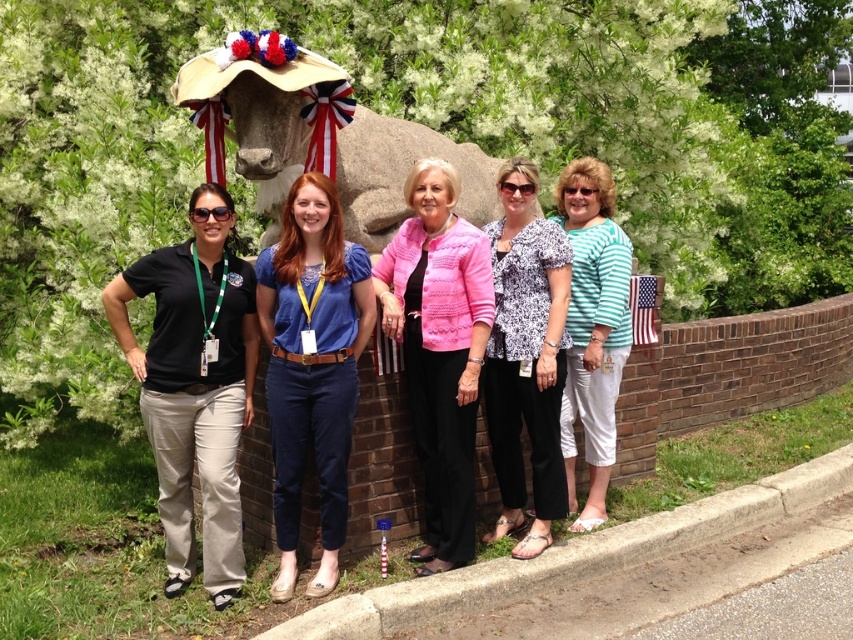
In the scene shown: Does stone statue at center have a larger size compared to pink textured sweater at center?

Yes, stone statue at center is bigger than pink textured sweater at center.

Between point (374, 250) and point (442, 410), which one is positioned in front?

Point (442, 410)

Which is behind, point (296, 56) or point (461, 365)?

The point (461, 365) is more distant.

The height and width of the screenshot is (640, 853). What are the coordinates of `stone statue at center` in the screenshot? It's located at (323, 134).

Is the position of pink textured sweater at center less distant than that of white printed blouse at center?

That is True.

This screenshot has width=853, height=640. Find the location of `pink textured sweater at center`. pink textured sweater at center is located at coordinates (439, 349).

Is point (457, 372) positioned after point (503, 484)?

No, it is not.

Image resolution: width=853 pixels, height=640 pixels. I want to click on pink textured sweater at center, so click(x=439, y=349).

Who is positioned more to the right, black cotton shirt at left or green striped shirt at center?

Positioned to the right is green striped shirt at center.

Is black cotton shirt at left bigger than green striped shirt at center?

Yes, black cotton shirt at left is bigger than green striped shirt at center.

Between point (173, 301) and point (572, 474), which one is positioned behind?

Positioned behind is point (572, 474).

This screenshot has height=640, width=853. Identify the location of black cotton shirt at left. (194, 387).